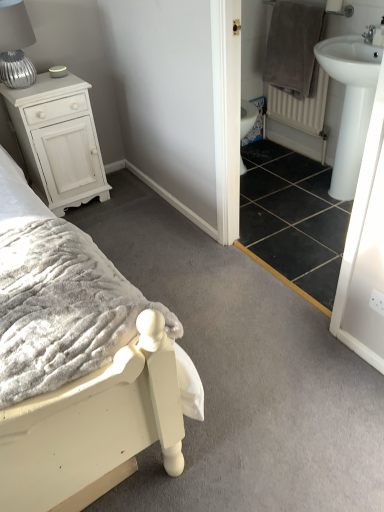
Identify the location of blank space to the left of white textured radiator at right. (266, 152).